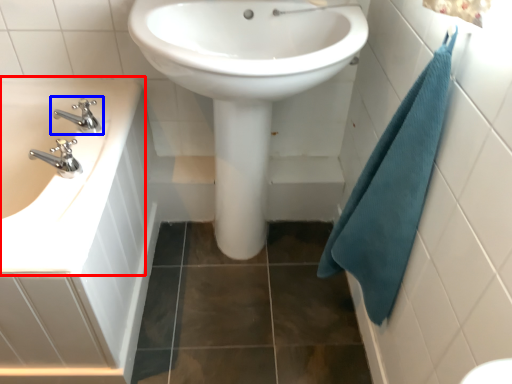
Question: Which object is closer to the camera taking this photo, sink (highlighted by a red box) or tap (highlighted by a blue box)?

Choices:
 (A) sink
 (B) tap

Answer: (A)